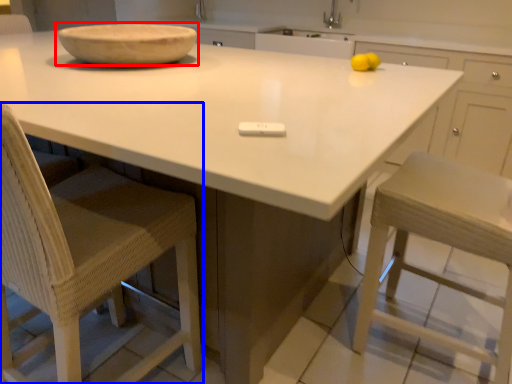
Question: Which of the following is the farthest to the observer, bowl (highlighted by a red box) or chair (highlighted by a blue box)?

Choices:
 (A) bowl
 (B) chair

Answer: (A)